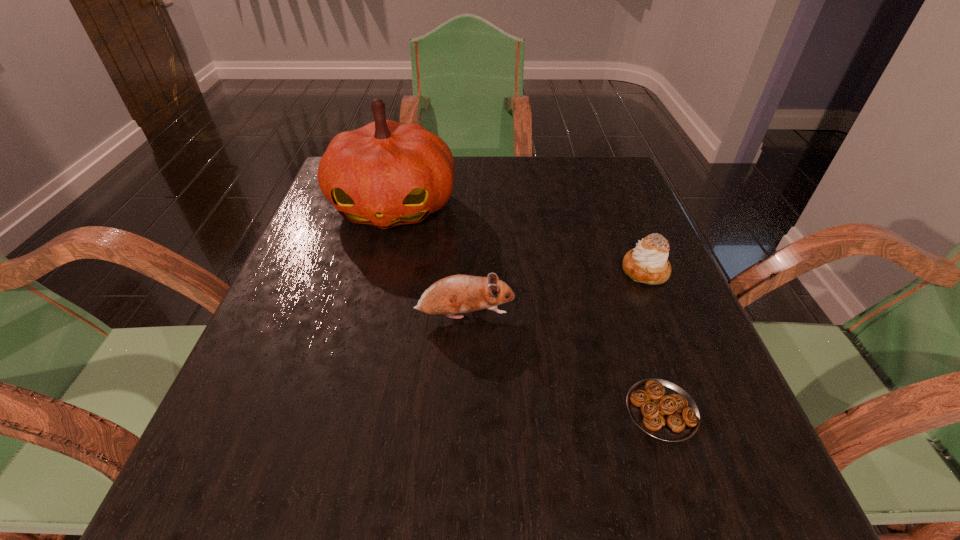
Image resolution: width=960 pixels, height=540 pixels. Identify the location of vacant area between the pumpkin and the shortest object. (527, 308).

The height and width of the screenshot is (540, 960). In order to click on vacant area between the farther pastry and the shortest object in this screenshot , I will do `click(653, 341)`.

Locate an element on the screen. empty space between the third farthest object and the pumpkin is located at coordinates (429, 261).

Image resolution: width=960 pixels, height=540 pixels. Find the location of `empty space that is in between the third nearest object and the tallest object`. empty space that is in between the third nearest object and the tallest object is located at coordinates (519, 239).

Find the location of a particular element. This screenshot has height=540, width=960. empty location between the farthest object and the hamster is located at coordinates (429, 261).

You are a GUI agent. You are given a task and a screenshot of the screen. Output one action in this format:
    pyautogui.click(x=<x>, y=<y>)
    Task: Click on the vacant area between the second nearest object and the shortest object
    Image resolution: width=960 pixels, height=540 pixels.
    Given the screenshot: What is the action you would take?
    pyautogui.click(x=564, y=363)

Where is `free space between the third nearest object and the hamster`? free space between the third nearest object and the hamster is located at coordinates (555, 293).

Locate an element on the screen. This screenshot has width=960, height=540. blank region between the nearest object and the taller pastry is located at coordinates (653, 341).

Identify the location of object that stands as the closest to the shortest object. (455, 294).

The height and width of the screenshot is (540, 960). What are the coordinates of `the closest object to the second nearest object` in the screenshot? It's located at (385, 174).